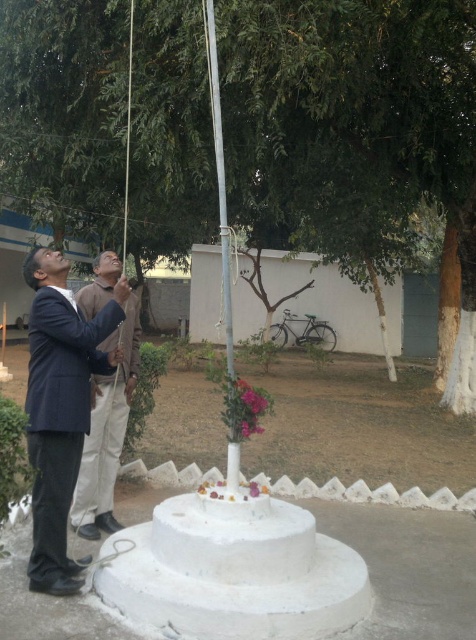
Who is higher up, green leafy tree at center or silver metallic pole at center?

green leafy tree at center is higher up.

The image size is (476, 640). I want to click on green leafy tree at center, so click(x=356, y=132).

Which is more to the left, white matte wedding cake at center or silver metallic pole at center?

Positioned to the left is silver metallic pole at center.

This screenshot has width=476, height=640. Find the location of `white matte wedding cake at center`. white matte wedding cake at center is located at coordinates (232, 570).

You are a GUI agent. You are given a task and a screenshot of the screen. Output one action in this format:
    pyautogui.click(x=<x>, y=<y>)
    Task: Click on the white matte wedding cake at center
    Image resolution: width=476 pixels, height=640 pixels.
    Given the screenshot: What is the action you would take?
    pyautogui.click(x=232, y=570)

Who is lower down, dark blue suit at left or silver metallic pole at center?

dark blue suit at left is below.

Is dark blue suit at left further to camera compared to silver metallic pole at center?

Yes, it is behind silver metallic pole at center.

Locate an element on the screen. dark blue suit at left is located at coordinates (107, 432).